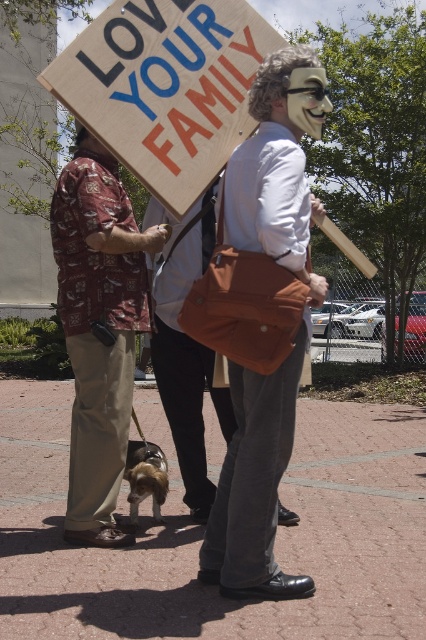
Which of these two, wooden sign at upper center or printed fabric shirt at left, stands shorter?

Standing shorter between the two is wooden sign at upper center.

Is the position of wooden sign at upper center less distant than that of printed fabric shirt at left?

Yes.

Does point (178, 177) come behind point (144, 285)?

No, (178, 177) is closer to viewer.

This screenshot has width=426, height=640. Identify the location of wooden sign at upper center. (166, 88).

Who is taller, wooden sign at upper center or matte brown bag at center?

matte brown bag at center

Locate an element on the screen. The width and height of the screenshot is (426, 640). wooden sign at upper center is located at coordinates (166, 88).

The image size is (426, 640). I want to click on wooden sign at upper center, so click(x=166, y=88).

Is matte brown bag at center thinner than printed fabric shirt at left?

Yes, matte brown bag at center is thinner than printed fabric shirt at left.

Who is more forward, (216, 570) or (97, 467)?

Positioned in front is point (216, 570).

Identify the location of matte brown bag at center. This screenshot has height=640, width=426. (279, 362).